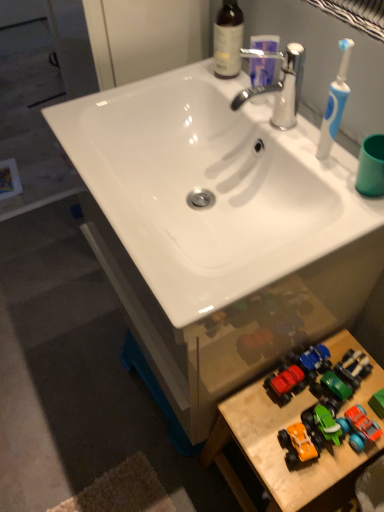
This screenshot has height=512, width=384. Describe the element at coordinates (279, 84) in the screenshot. I see `chrome metallic faucet at upper center` at that location.

The width and height of the screenshot is (384, 512). I want to click on chrome metallic faucet at upper center, so click(279, 84).

I want to click on white glossy sink at center, so click(x=210, y=187).

Describe the element at coordinates (210, 187) in the screenshot. This screenshot has width=384, height=512. I see `white glossy sink at center` at that location.

Looking at this image, measure the distance between point (306, 442) and camera.

They are 32.60 inches apart.

What do you see at coordinates (297, 445) in the screenshot? I see `orange matte toy car at lower right` at bounding box center [297, 445].

Find the location of `chrome metallic faucet at upper center`. chrome metallic faucet at upper center is located at coordinates (279, 84).

From the image's perspective, is brown glass bottle at upper center above or below wooden toy cars at lower right?

brown glass bottle at upper center is above wooden toy cars at lower right.

Considering the sizes of objects brown glass bottle at upper center and wooden toy cars at lower right in the image provided, who is taller, brown glass bottle at upper center or wooden toy cars at lower right?

wooden toy cars at lower right.

Which of these two, orange matte toy car at lower right or white glossy sink at center, is wider?

white glossy sink at center is wider.

Would you say orange matte toy car at lower right is inside or outside white glossy sink at center?

orange matte toy car at lower right exists outside the volume of white glossy sink at center.

Between orange matte toy car at lower right and white glossy sink at center, which one has less height?

orange matte toy car at lower right is shorter.

From a real-world perspective, is chrome metallic faucet at upper center physically above orange matte toy car at lower right?

Correct, in the physical world, chrome metallic faucet at upper center is higher than orange matte toy car at lower right.

In the image, is chrome metallic faucet at upper center positioned in front of or behind orange matte toy car at lower right?

In the image, chrome metallic faucet at upper center appears in front of orange matte toy car at lower right.

From the image's perspective, is chrome metallic faucet at upper center on orange matte toy car at lower right?

Yes, from the image's perspective, chrome metallic faucet at upper center is on top of orange matte toy car at lower right.

Considering the sizes of chrome metallic faucet at upper center and orange matte toy car at lower right in the image, is chrome metallic faucet at upper center taller or shorter than orange matte toy car at lower right?

Considering their sizes, chrome metallic faucet at upper center has more height than orange matte toy car at lower right.

Is white glossy sink at center situated inside orange matte toy car at lower right or outside?

white glossy sink at center lies outside orange matte toy car at lower right.

Between white glossy sink at center and orange matte toy car at lower right, which one has larger width?

Wider between the two is white glossy sink at center.

Could you tell me if white glossy sink at center is turned towards orange matte toy car at lower right?

No, white glossy sink at center is not facing towards orange matte toy car at lower right.

Which is more to the left, white glossy sink at center or orange matte toy car at lower right?

Positioned to the left is white glossy sink at center.

From the image's perspective, is brown glass bottle at upper center above or below chrome metallic faucet at upper center?

Based on their image positions, brown glass bottle at upper center is located above chrome metallic faucet at upper center.

From a real-world perspective, which is physically below, brown glass bottle at upper center or chrome metallic faucet at upper center?

chrome metallic faucet at upper center is physically lower.

Is brown glass bottle at upper center positioned with its back to chrome metallic faucet at upper center?

brown glass bottle at upper center does not have its back to chrome metallic faucet at upper center.

At what (x,y) coordinates should I click in order to perform the action: click on tap on the right of brown glass bottle at upper center. Please return your answer as a coordinate pair (x, y). The image size is (384, 512). Looking at the image, I should click on click(279, 84).

From a real-world perspective, is chrome metallic faucet at upper center under wooden toy cars at lower right?

No.

Considering the points (286, 101) and (349, 450), which point is in front, point (286, 101) or point (349, 450)?

The point (349, 450) is closer to the camera.

Relative to wooden toy cars at lower right, is chrome metallic faucet at upper center in front or behind?

In the image, chrome metallic faucet at upper center appears in front of wooden toy cars at lower right.

From the picture: Considering the sizes of objects chrome metallic faucet at upper center and wooden toy cars at lower right in the image provided, who is smaller, chrome metallic faucet at upper center or wooden toy cars at lower right?

Smaller between the two is chrome metallic faucet at upper center.

How far apart are wooden toy cars at lower right and white glossy sink at center?

They are 18.84 inches apart.

Which is in front, point (296, 473) or point (114, 106)?

The point (296, 473) is in front.

Considering the sizes of objects wooden toy cars at lower right and white glossy sink at center in the image provided, who is wider, wooden toy cars at lower right or white glossy sink at center?

Wider between the two is white glossy sink at center.

At what (x,y) coordinates should I click in order to perform the action: click on sink above the wooden toy cars at lower right (from a real-world perspective). Please return your answer as a coordinate pair (x, y). Looking at the image, I should click on (210, 187).

The image size is (384, 512). In order to click on table below the brown glass bottle at upper center (from the image's perspective) in this screenshot , I will do click(280, 447).

Image resolution: width=384 pixels, height=512 pixels. Identify the location of sink in front of the orange matte toy car at lower right. (210, 187).

From the picture: Looking at the image, which one is located closer to white glossy sink at center, orange matte toy car at lower right or brown glass bottle at upper center?

brown glass bottle at upper center lies closer to white glossy sink at center than the other object.

Based on their spatial positions, is chrome metallic faucet at upper center or brown glass bottle at upper center further from white glossy sink at center?

brown glass bottle at upper center is positioned further to the anchor white glossy sink at center.

When comparing their distances from white glossy sink at center, does chrome metallic faucet at upper center or wooden toy cars at lower right seem closer?

Based on the image, chrome metallic faucet at upper center appears to be nearer to white glossy sink at center.

In the scene shown: Which object lies further to the anchor point chrome metallic faucet at upper center, white glossy sink at center or wooden toy cars at lower right?

The object further to chrome metallic faucet at upper center is wooden toy cars at lower right.

Based on their spatial positions, is brown glass bottle at upper center or chrome metallic faucet at upper center further from orange matte toy car at lower right?

brown glass bottle at upper center lies further to orange matte toy car at lower right than the other object.

Looking at the image, which one is located closer to brown glass bottle at upper center, white glossy sink at center or wooden toy cars at lower right?

Among the two, white glossy sink at center is located nearer to brown glass bottle at upper center.

When comparing their distances from white glossy sink at center, does wooden toy cars at lower right or chrome metallic faucet at upper center seem further?

Based on the image, wooden toy cars at lower right appears to be further to white glossy sink at center.

Based on their spatial positions, is wooden toy cars at lower right or chrome metallic faucet at upper center further from brown glass bottle at upper center?

wooden toy cars at lower right lies further to brown glass bottle at upper center than the other object.

Identify the location of toy that lies between brown glass bottle at upper center and wooden toy cars at lower right from top to bottom. Image resolution: width=384 pixels, height=512 pixels. (297, 445).

At what (x,y) coordinates should I click in order to perform the action: click on sink between chrome metallic faucet at upper center and wooden toy cars at lower right vertically. Please return your answer as a coordinate pair (x, y). This screenshot has height=512, width=384. Looking at the image, I should click on (210, 187).

The image size is (384, 512). Find the location of `sink between chrome metallic faucet at upper center and orange matte toy car at lower right from top to bottom`. sink between chrome metallic faucet at upper center and orange matte toy car at lower right from top to bottom is located at coordinates (210, 187).

Image resolution: width=384 pixels, height=512 pixels. I want to click on sink between brown glass bottle at upper center and orange matte toy car at lower right in the vertical direction, so click(210, 187).